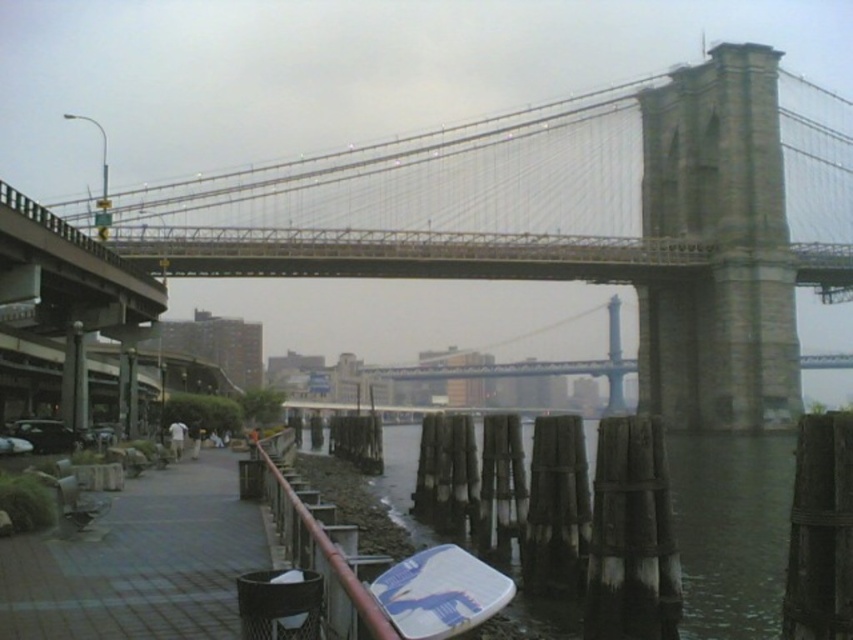
Is stone gray suspension bridge at center taller than brown wooden posts at lower center?

Yes.

Is point (550, 260) positioned behind point (415, 438)?

No, it is in front of (415, 438).

At what (x,y) coordinates should I click in order to perform the action: click on stone gray suspension bridge at center. Please return your answer as a coordinate pair (x, y). Looking at the image, I should click on (572, 218).

Is point (747, 301) less distant than point (201, 467)?

No, (747, 301) is behind (201, 467).

Between stone gray suspension bridge at center and wooden dock at lower left, which one has less height?

wooden dock at lower left

Describe the element at coordinates (572, 218) in the screenshot. Image resolution: width=853 pixels, height=640 pixels. I see `stone gray suspension bridge at center` at that location.

Image resolution: width=853 pixels, height=640 pixels. What are the coordinates of `stone gray suspension bridge at center` in the screenshot? It's located at (572, 218).

Is the position of stone gray suspension bridge at center less distant than that of brown wooden rail at lower left?

No, stone gray suspension bridge at center is further to the viewer.

Which is behind, point (273, 234) or point (326, 608)?

The point (273, 234) is behind.

What do you see at coordinates (572, 218) in the screenshot? I see `stone gray suspension bridge at center` at bounding box center [572, 218].

This screenshot has height=640, width=853. Identify the location of stone gray suspension bridge at center. (572, 218).